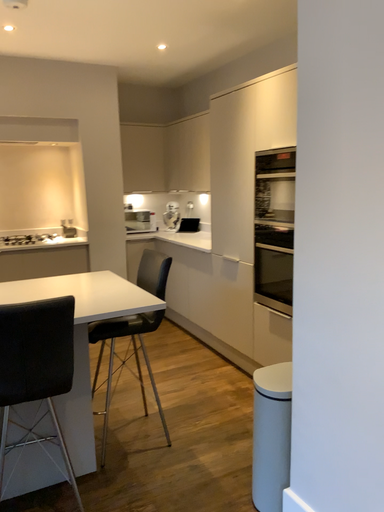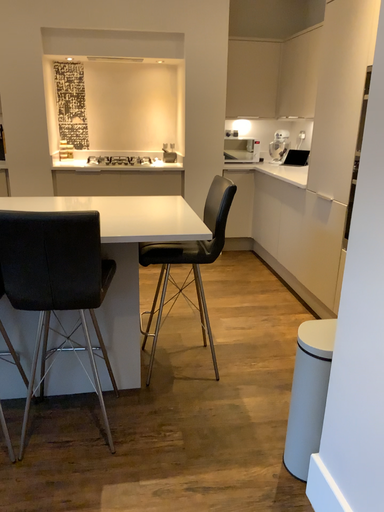
Question: Which way did the camera rotate in the video?

Choices:
 (A) rotated upward
 (B) rotated downward

Answer: (B)